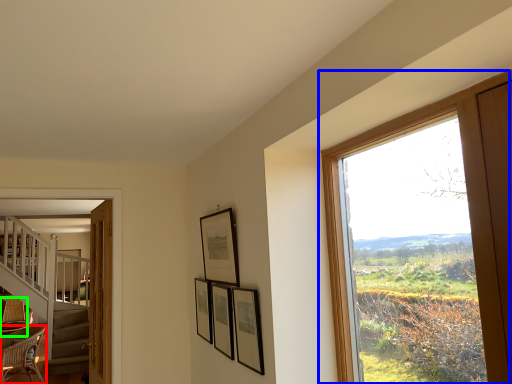
Question: Which object is the closest to the chair (highlighted by a red box)? Choose among these: window (highlighted by a blue box) or armchair (highlighted by a green box).

Choices:
 (A) window
 (B) armchair

Answer: (B)